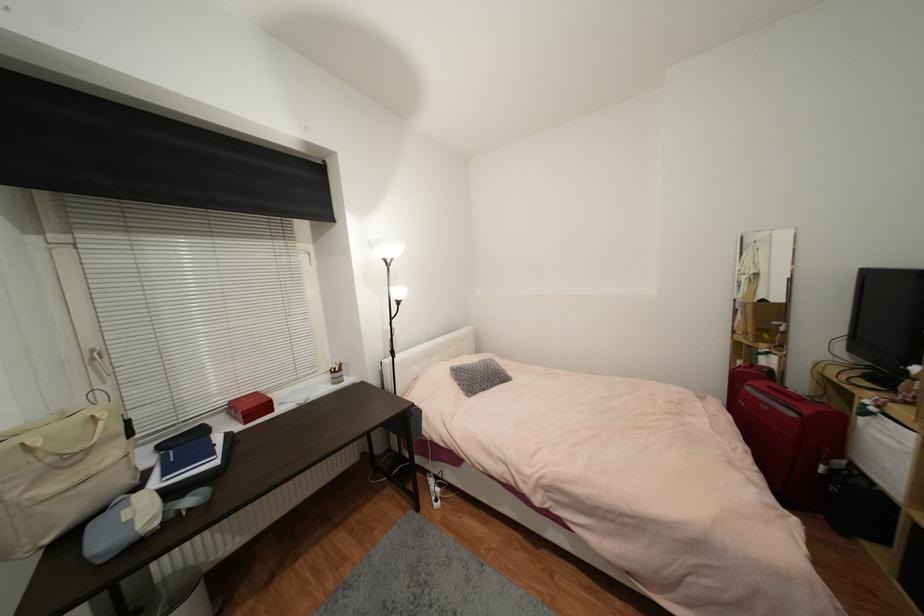
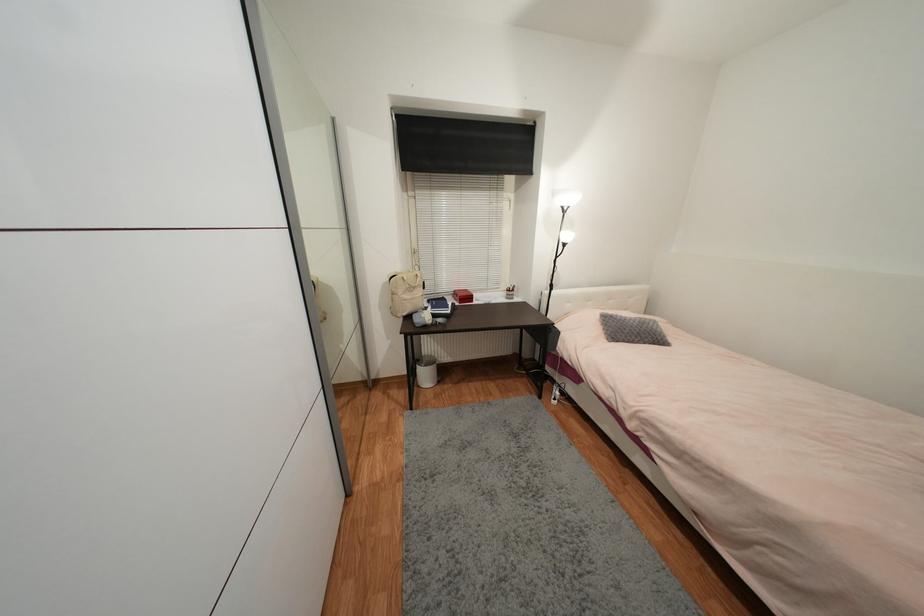
Locate, in the second image, the point that corresponds to (x=162, y=581) in the first image.

(428, 355)